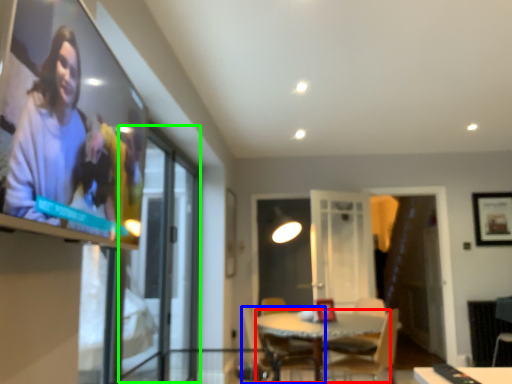
Question: Estimate the real-world distances between objects in this image. Which object is closer to glass table (highlighted by a red box), chair (highlighted by a blue box) or screen door (highlighted by a green box)?

Choices:
 (A) chair
 (B) screen door

Answer: (A)